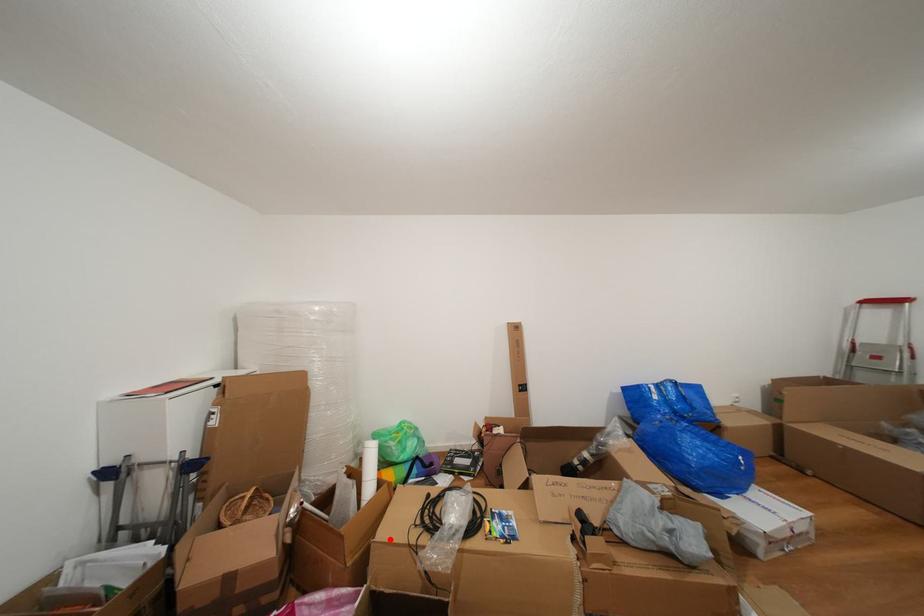
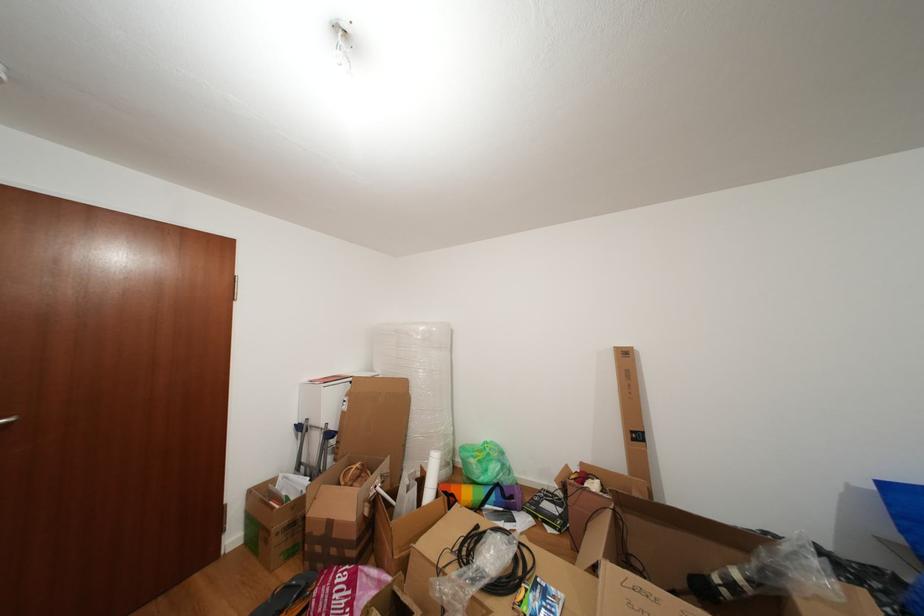
Where in the second image is the point corresponding to the highlighted location from the first image?

(431, 548)